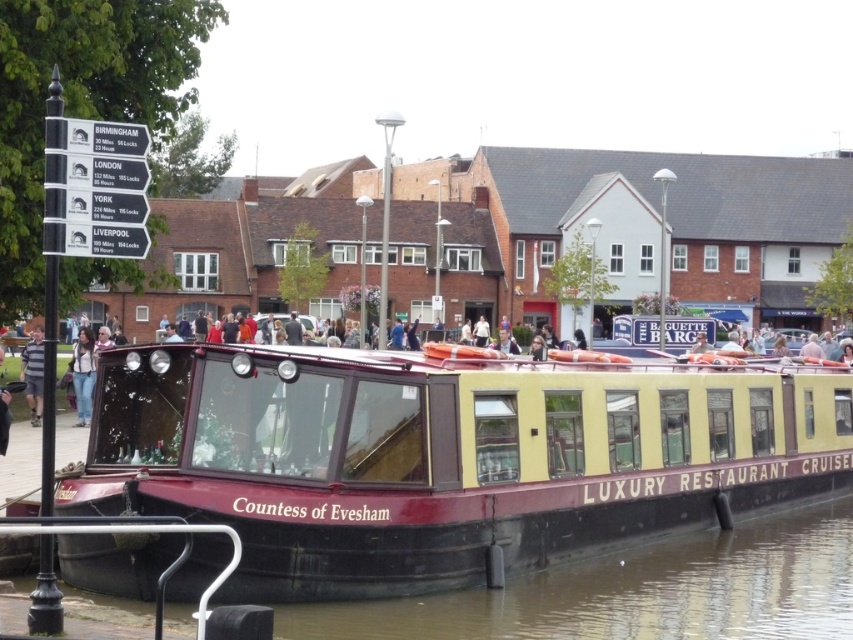
Is denim jeans at lower left thinner than striped cotton shirt at left?

Yes, denim jeans at lower left is thinner than striped cotton shirt at left.

Which is behind, point (78, 356) or point (36, 424)?

Positioned behind is point (78, 356).

Which is in front, point (79, 412) or point (41, 381)?

Point (79, 412) is more forward.

Locate an element on the screen. denim jeans at lower left is located at coordinates (83, 374).

From the picture: Between maroon polished wood boat at center and denim jeans at lower left, which one has less height?

With less height is denim jeans at lower left.

This screenshot has height=640, width=853. What do you see at coordinates (447, 456) in the screenshot?
I see `maroon polished wood boat at center` at bounding box center [447, 456].

The width and height of the screenshot is (853, 640). I want to click on maroon polished wood boat at center, so click(447, 456).

Does maroon polished wood boat at center come in front of striped cotton shirt at left?

Yes, it is.

Is maroon polished wood boat at center shorter than striped cotton shirt at left?

In fact, maroon polished wood boat at center may be taller than striped cotton shirt at left.

Where is `maroon polished wood boat at center`? maroon polished wood boat at center is located at coordinates (447, 456).